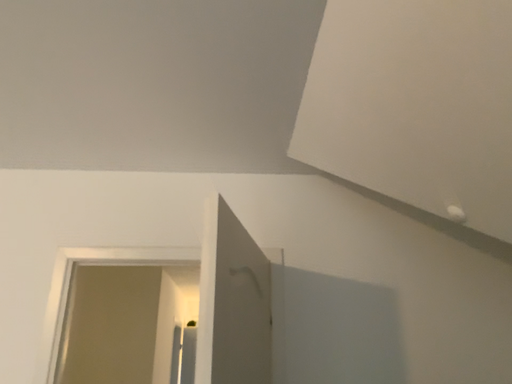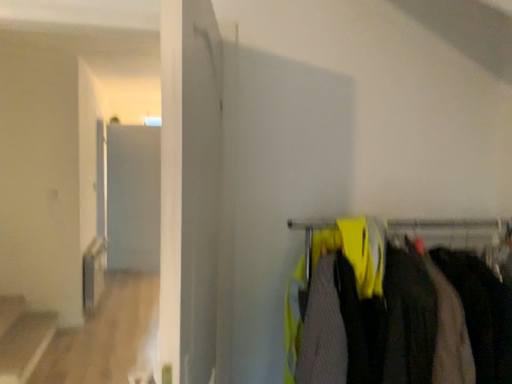
Question: How did the camera likely rotate when shooting the video?

Choices:
 (A) rotated right
 (B) rotated left

Answer: (A)